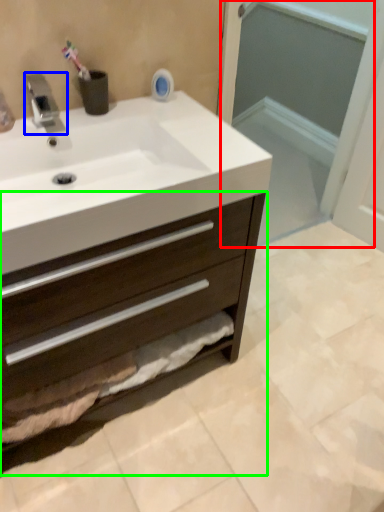
Question: Which is farther away from screen door (highlighted by a red box)? tap (highlighted by a blue box) or bathroom cabinet (highlighted by a green box)?

Choices:
 (A) tap
 (B) bathroom cabinet

Answer: (A)